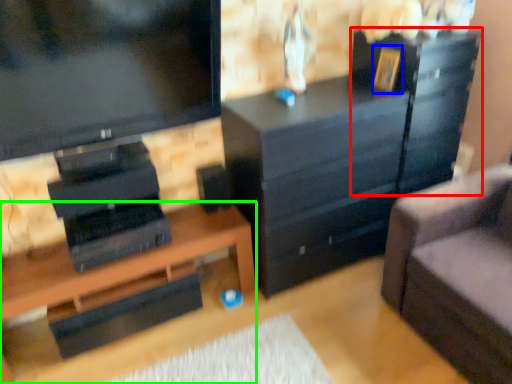
Question: Which is farther away from file cabinet (highlighted by a red box)? picture frame (highlighted by a blue box) or desk (highlighted by a green box)?

Choices:
 (A) picture frame
 (B) desk

Answer: (B)